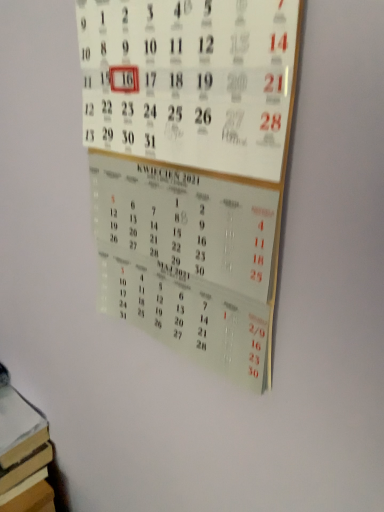
This screenshot has width=384, height=512. What do you see at coordinates (19, 426) in the screenshot?
I see `brown cardboard book at lower left` at bounding box center [19, 426].

At what (x,y) coordinates should I click in order to perform the action: click on brown cardboard book at lower left. Please return your answer as a coordinate pair (x, y). Looking at the image, I should click on coord(19,426).

In order to face white paper calendar at center, should I rotate leftwards or rightwards?

To face it directly, rotate left by 3.438 degrees.

Locate an element on the screen. The height and width of the screenshot is (512, 384). white paper calendar at center is located at coordinates (191, 168).

What do you see at coordinates (191, 168) in the screenshot? I see `white paper calendar at center` at bounding box center [191, 168].

Identify the location of brown cardboard book at lower left. This screenshot has width=384, height=512. tap(19, 426).

Is white paper calendar at center at the left side of brown cardboard book at lower left?

Incorrect, white paper calendar at center is not on the left side of brown cardboard book at lower left.

Considering their positions, is white paper calendar at center located in front of or behind brown cardboard book at lower left?

Clearly, white paper calendar at center is in front of brown cardboard book at lower left.

Which is closer to the camera, (x=206, y=46) or (x=31, y=452)?

The point (x=206, y=46) is in front.

From the image's perspective, is white paper calendar at center over brown cardboard book at lower left?

Yes, from the image's perspective, white paper calendar at center is on top of brown cardboard book at lower left.

From a real-world perspective, is white paper calendar at center positioned under brown cardboard book at lower left based on gravity?

Actually, white paper calendar at center is physically above brown cardboard book at lower left in the real world.

In terms of width, does white paper calendar at center look wider or thinner when compared to brown cardboard book at lower left?

In the image, white paper calendar at center appears to be more narrow than brown cardboard book at lower left.

In terms of height, does white paper calendar at center look taller or shorter compared to brown cardboard book at lower left?

white paper calendar at center is taller than brown cardboard book at lower left.

Considering the sizes of objects white paper calendar at center and brown cardboard book at lower left in the image provided, who is bigger, white paper calendar at center or brown cardboard book at lower left?

Bigger between the two is white paper calendar at center.

Do you think white paper calendar at center is within brown cardboard book at lower left, or outside of it?

white paper calendar at center is outside brown cardboard book at lower left.

Is white paper calendar at center far from brown cardboard book at lower left?

white paper calendar at center is near brown cardboard book at lower left, not far away.

Is white paper calendar at center aimed at brown cardboard book at lower left?

No, white paper calendar at center is not turned towards brown cardboard book at lower left.

What's the angular difference between white paper calendar at center and brown cardboard book at lower left's facing directions?

87.4 degrees separate the facing orientations of white paper calendar at center and brown cardboard book at lower left.

I want to click on bulletin board above the brown cardboard book at lower left (from a real-world perspective), so click(x=191, y=168).

Is brown cardboard book at lower left at the left side of white paper calendar at center?

Yes.

Does brown cardboard book at lower left lie behind white paper calendar at center?

Yes.

Which point is more forward, [13,452] or [87,109]?

Point [87,109]

From the image's perspective, which one is positioned lower, brown cardboard book at lower left or white paper calendar at center?

From the image's view, brown cardboard book at lower left is below.

From a real-world perspective, between brown cardboard book at lower left and white paper calendar at center, who is vertically lower?

brown cardboard book at lower left, from a real-world perspective.

In the scene shown: Can you confirm if brown cardboard book at lower left is wider than white paper calendar at center?

Yes, brown cardboard book at lower left is wider than white paper calendar at center.

Considering the relative sizes of brown cardboard book at lower left and white paper calendar at center in the image provided, is brown cardboard book at lower left shorter than white paper calendar at center?

Yes.

Who is smaller, brown cardboard book at lower left or white paper calendar at center?

Smaller between the two is brown cardboard book at lower left.

Is brown cardboard book at lower left spatially inside white paper calendar at center, or outside of it?

The correct answer is: outside.

Is the surface of brown cardboard book at lower left in direct contact with white paper calendar at center?

brown cardboard book at lower left is not next to white paper calendar at center, and they're not touching.

Could you tell me if brown cardboard book at lower left is turned towards white paper calendar at center?

No, brown cardboard book at lower left is not turned towards white paper calendar at center.

What's the angular difference between brown cardboard book at lower left and white paper calendar at center's facing directions?

The facing directions of brown cardboard book at lower left and white paper calendar at center are 87.4 degrees apart.

Where is `book on the left of the white paper calendar at center`? book on the left of the white paper calendar at center is located at coordinates (19, 426).

Where is `book below the white paper calendar at center (from the image's perspective)`? This screenshot has height=512, width=384. book below the white paper calendar at center (from the image's perspective) is located at coordinates (19, 426).

The image size is (384, 512). Find the location of `bulletin board that is on the right side of brown cardboard book at lower left`. bulletin board that is on the right side of brown cardboard book at lower left is located at coordinates (191, 168).